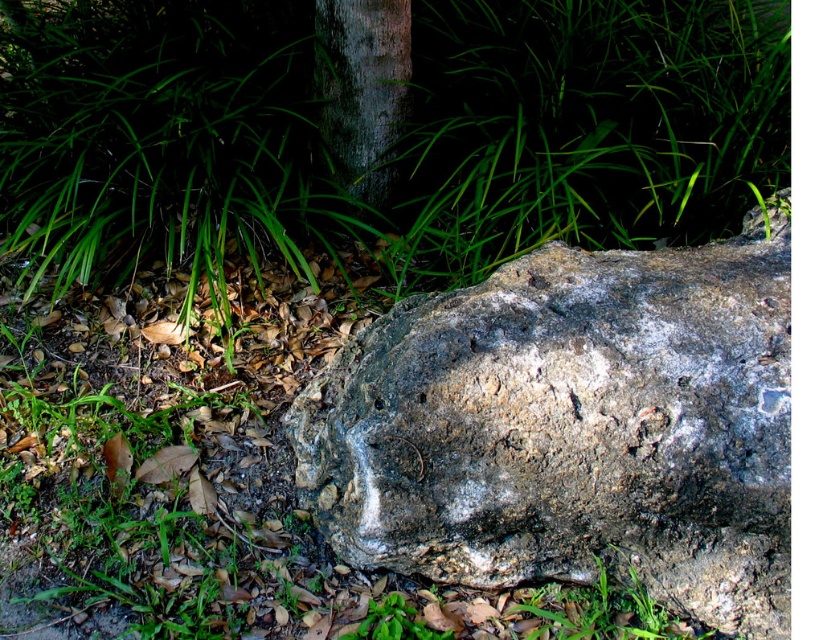
Does gray rough rock at center have a lesser width compared to smooth gray bark at center?

In fact, gray rough rock at center might be wider than smooth gray bark at center.

Which is more to the right, gray rough rock at center or smooth gray bark at center?

Positioned to the right is gray rough rock at center.

Locate an element on the screen. Image resolution: width=823 pixels, height=640 pixels. gray rough rock at center is located at coordinates (573, 428).